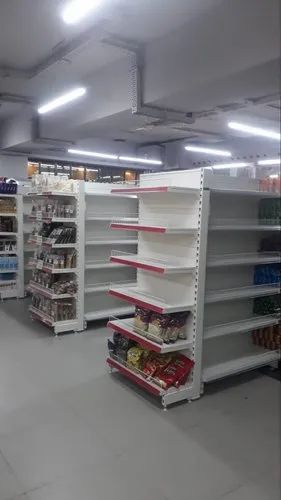
Find the location of a particular element. This screenshot has width=281, height=500. half-stocked shelves is located at coordinates (242, 192), (237, 226), (238, 260), (236, 293), (233, 327), (233, 362).